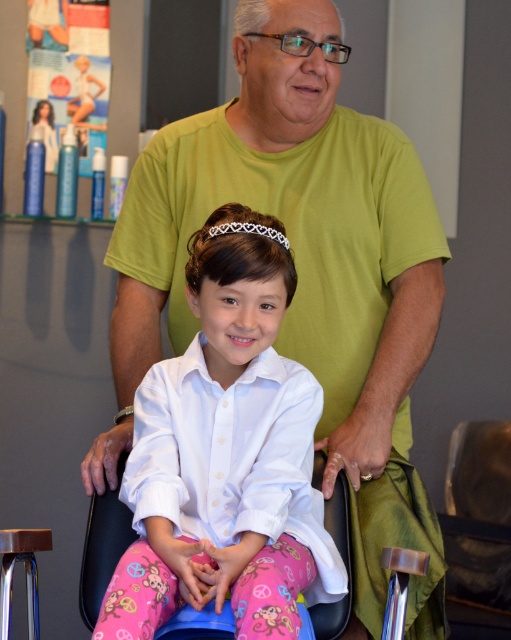
You are a physical therapist helping a client who uses a wheelchair. You need to place a white lace tiara at center on the pink fabric wheelchair at center. Will the tiara fit on the wheelchair without falling off?

The pink fabric wheelchair at center has a larger size compared to white lace tiara at center. Since the wheelchair is bigger, the tiara will fit securely on the wheelchair without falling off.

From the picture: In the hair salon scene, there is a young girl wearing a white button up shirt and pink pajama pants with monkey designs and peace signs. There is also a point marked at center. What object is located at the coordinates point (x=301, y=275)?

The point (x=301, y=275) indicates the green cotton shirt at center.

You are a physical therapist assisting a client in a hair salon. You need to move the pink fabric wheelchair at center closer to the white lace tiara at center. Considering their sizes, will the wheelchair fit through the doorway leading to the adjacent room which is 1 meter wide?

The pink fabric wheelchair at center has a lesser width compared to white lace tiara at center, but without specific measurements of the wheelchair itself, we cannot confirm if it will fit through the 1 meter wide doorway. Additional information about the wheelchair dimensions is required.